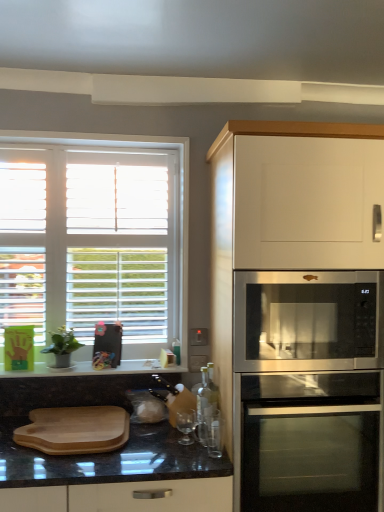
This screenshot has height=512, width=384. I want to click on free space above wooden cutting board at lower left (from a real-world perspective), so click(82, 420).